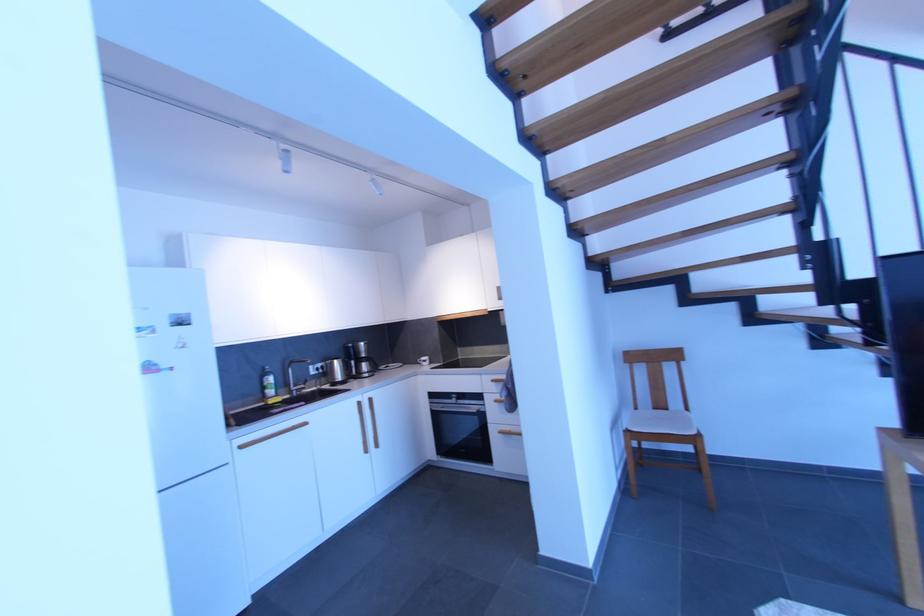
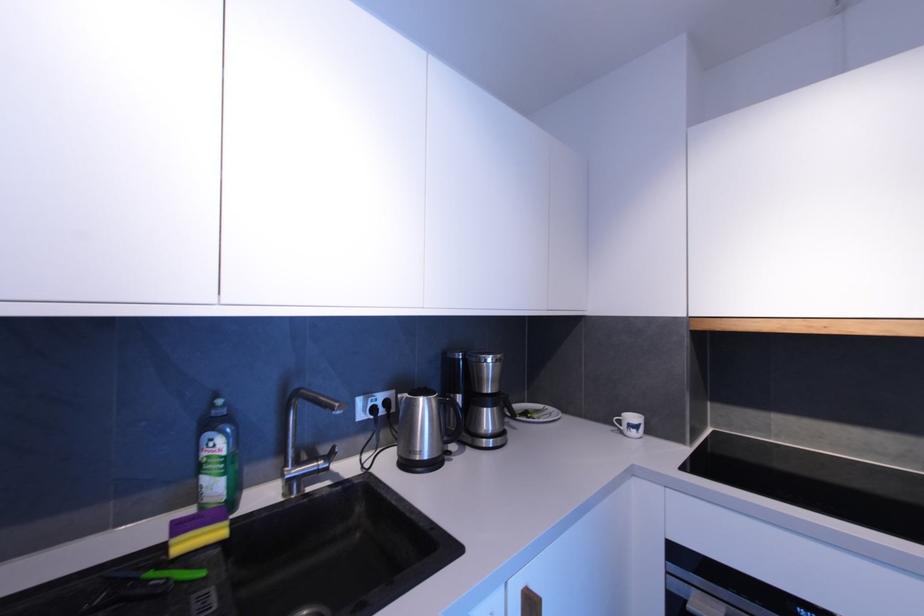
Locate, in the second image, the point that corresponds to (x=351, y=376) in the first image.

(450, 440)